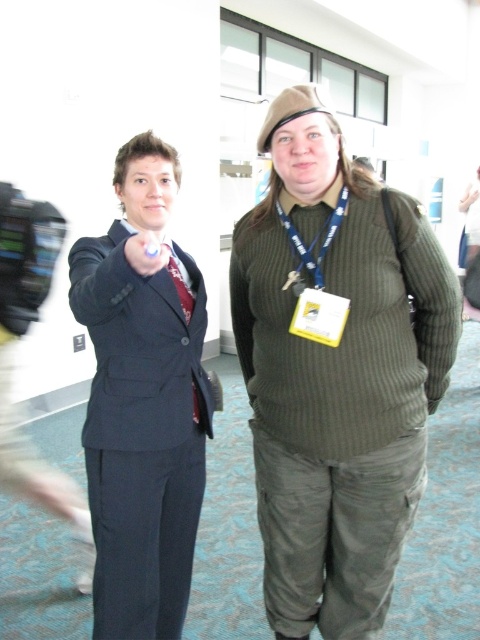
What do you see at coordinates (337, 380) in the screenshot? Image resolution: width=480 pixels, height=640 pixels. I see `matte black suit at left` at bounding box center [337, 380].

Consider the image. Which of these two, matte black suit at left or blue fabric lanyard at center, stands taller?

With more height is matte black suit at left.

Does point (294, 550) come farther from viewer compared to point (345, 196)?

Yes, it is.

I want to click on matte black suit at left, so click(x=337, y=380).

Is matte black suit at left to the left of matte black suit at center from the viewer's perspective?

Incorrect, matte black suit at left is not on the left side of matte black suit at center.

Is point (290, 138) closer to camera compared to point (163, 403)?

Yes, point (290, 138) is in front of point (163, 403).

Where is `matte black suit at left`? The image size is (480, 640). matte black suit at left is located at coordinates (337, 380).

You are a GUI agent. You are given a task and a screenshot of the screen. Output one action in this format:
    pyautogui.click(x=<x>, y=<y>)
    Task: Click on the matte black suit at left
    Image resolution: width=480 pixels, height=640 pixels.
    Given the screenshot: What is the action you would take?
    337,380

Does blue fabric lanyard at center appear on the left side of green fabric neck at center?

Yes, blue fabric lanyard at center is to the left of green fabric neck at center.

Which of these two, blue fabric lanyard at center or green fabric neck at center, stands taller?

With more height is blue fabric lanyard at center.

The height and width of the screenshot is (640, 480). What do you see at coordinates (323, 243) in the screenshot?
I see `blue fabric lanyard at center` at bounding box center [323, 243].

The height and width of the screenshot is (640, 480). What are the coordinates of `blue fabric lanyard at center` in the screenshot? It's located at (323, 243).